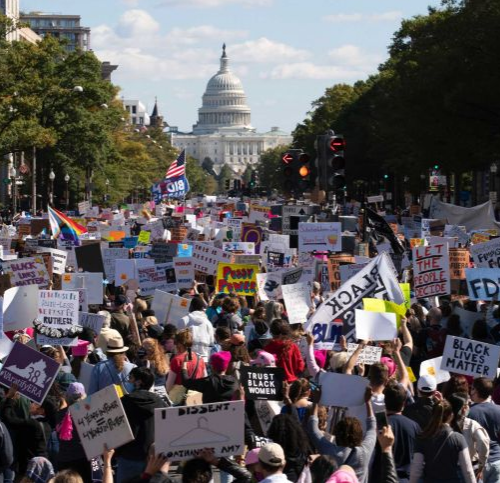
Locate an element on the screen. Image resolution: width=500 pixels, height=483 pixels. coat hanger is located at coordinates (197, 424).